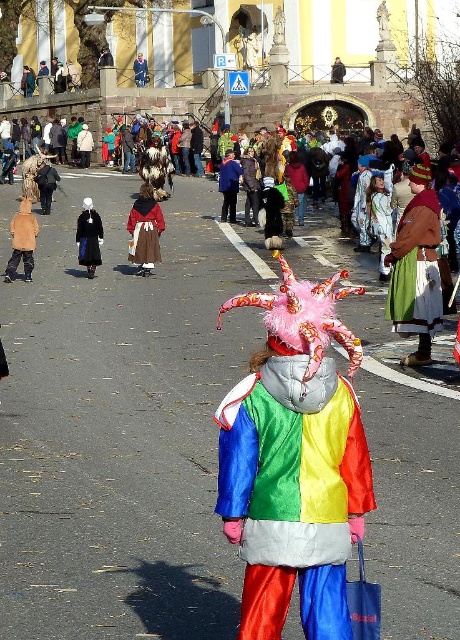
You are standing on the street and want to take a photo of the rainbow satin costume at center. If your camera can focus up to 10 meters, will you be able to take a clear photo?

The rainbow satin costume at center and viewer are 9.14 meters apart. Since your camera can focus up to 10 meters, the distance of 9.14 meters is within the camera range, so yes, you can take a clear photo.

You are a photographer trying to capture the rainbow satin costume at center and the velvet brown coat at center in a single frame. Based on their positions, which one is closer to the camera?

The rainbow satin costume at center is below the velvet brown coat at center, so the velvet brown coat at center is closer to the camera.